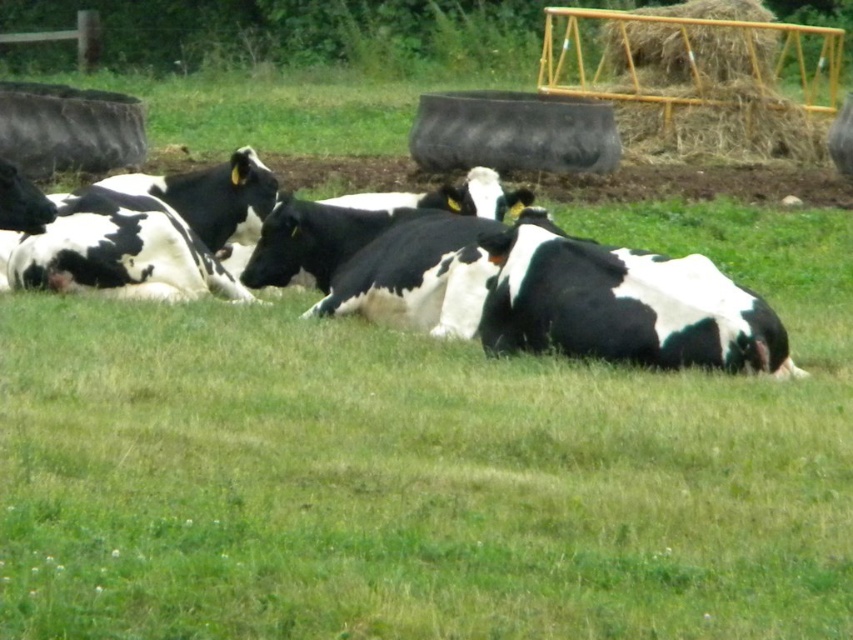
Can you confirm if black and white cow at center is taller than yellow metal hay at upper right?

No, black and white cow at center is not taller than yellow metal hay at upper right.

Which is above, black and white cow at center or yellow metal hay at upper right?

yellow metal hay at upper right

Locate an element on the screen. The image size is (853, 640). black and white cow at center is located at coordinates (614, 305).